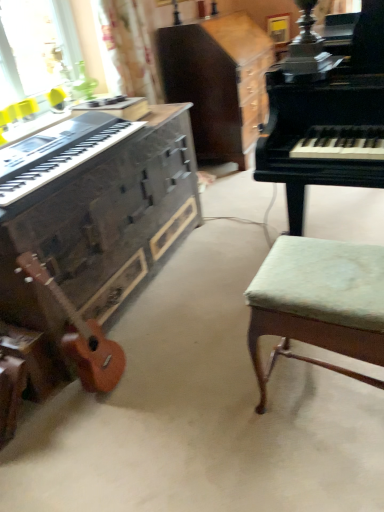
Question: Is point (13, 307) closer or farther from the camera than point (236, 154)?

Choices:
 (A) closer
 (B) farther

Answer: (A)

Question: Relative to wooden cabinet at center, is wooden piano at left, which ranks as the 2th piano in right-to-left order, in front or behind?

Choices:
 (A) front
 (B) behind

Answer: (A)

Question: Which is nearer to the black polished piano at upper right, the first piano in the right-to-left sequence?

Choices:
 (A) wooden acoustic guitar at lower left
 (B) wooden cabinet at center
 (C) wooden piano at left, which ranks as the 2th piano in right-to-left order
 (D) matte black keyboard at left
 (E) green fabric stool at right

Answer: (E)

Question: Which is nearer to the matte black keyboard at left?

Choices:
 (A) wooden acoustic guitar at lower left
 (B) green fabric stool at right
 (C) wooden cabinet at center
 (D) wooden piano at left, which ranks as the 2th piano in right-to-left order
 (E) black polished piano at upper right, the first piano in the right-to-left sequence

Answer: (D)